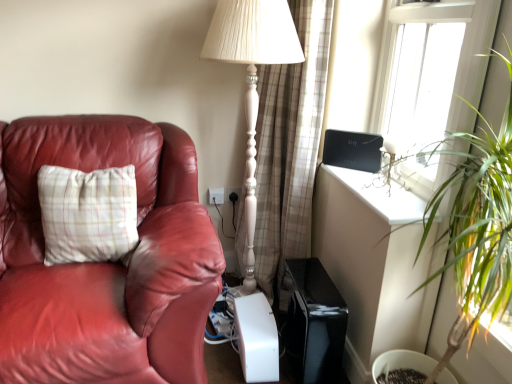
Image resolution: width=512 pixels, height=384 pixels. What are the coordinates of `white plastic electric outlet at lower center, arranged as the 2th electric outlet when viewed from the left` in the screenshot? It's located at (234, 194).

Image resolution: width=512 pixels, height=384 pixels. What do you see at coordinates (216, 196) in the screenshot?
I see `white plastic electric outlet at lower center, the first electric outlet in the left-to-right sequence` at bounding box center [216, 196].

Measure the distance between point (x=208, y=197) and camera.

They are 7.45 feet apart.

Where is `white plastic electric outlet at lower center, arranged as the 2th electric outlet when viewed from the left`? This screenshot has height=384, width=512. white plastic electric outlet at lower center, arranged as the 2th electric outlet when viewed from the left is located at coordinates (234, 194).

Is transparent glass window at upper right wider or thinner than white plastic electric outlet at lower center, which is counted as the first electric outlet, starting from the right?

In the image, transparent glass window at upper right appears to be wider than white plastic electric outlet at lower center, which is counted as the first electric outlet, starting from the right.

From the image's perspective, is transparent glass window at upper right below white plastic electric outlet at lower center, arranged as the 2th electric outlet when viewed from the left?

No, from the image's perspective, transparent glass window at upper right is not beneath white plastic electric outlet at lower center, arranged as the 2th electric outlet when viewed from the left.

Considering the relative sizes of transparent glass window at upper right and white plastic electric outlet at lower center, which is counted as the first electric outlet, starting from the right, in the image provided, is transparent glass window at upper right shorter than white plastic electric outlet at lower center, which is counted as the first electric outlet, starting from the right,?

In fact, transparent glass window at upper right may be taller than white plastic electric outlet at lower center, which is counted as the first electric outlet, starting from the right.

Could you tell me if transparent glass window at upper right is facing white plastic electric outlet at lower center, which is counted as the first electric outlet, starting from the right?

No, transparent glass window at upper right is not facing towards white plastic electric outlet at lower center, which is counted as the first electric outlet, starting from the right.

Is white plastic electric outlet at lower center, the 2th electric outlet viewed from the right, bigger than plaid fabric pillow at left?

No, white plastic electric outlet at lower center, the 2th electric outlet viewed from the right, is not bigger than plaid fabric pillow at left.

Looking at their sizes, would you say white plastic electric outlet at lower center, the 2th electric outlet viewed from the right, is wider or thinner than plaid fabric pillow at left?

Considering their sizes, white plastic electric outlet at lower center, the 2th electric outlet viewed from the right, looks slimmer than plaid fabric pillow at left.

From a real-world perspective, is white plastic electric outlet at lower center, the first electric outlet in the left-to-right sequence, over plaid fabric pillow at left?

No, from a real-world perspective, white plastic electric outlet at lower center, the first electric outlet in the left-to-right sequence, is not above plaid fabric pillow at left.

Can you tell me how much white plastic electric outlet at lower center, the 2th electric outlet viewed from the right, and plaid fabric pillow at left differ in facing direction?

14.5 degrees.

Is point (446, 1) farther from viewer compared to point (209, 191)?

No.

Is transparent glass window at upper right taller or shorter than white plastic electric outlet at lower center, the first electric outlet in the left-to-right sequence?

Clearly, transparent glass window at upper right is taller compared to white plastic electric outlet at lower center, the first electric outlet in the left-to-right sequence.

From a real-world perspective, is transparent glass window at upper right located higher than white plastic electric outlet at lower center, the 2th electric outlet viewed from the right?

Yes, from a real-world perspective, transparent glass window at upper right is over white plastic electric outlet at lower center, the 2th electric outlet viewed from the right

Considering the relative sizes of transparent glass window at upper right and white plastic electric outlet at lower center, the 2th electric outlet viewed from the right, in the image provided, is transparent glass window at upper right wider than white plastic electric outlet at lower center, the 2th electric outlet viewed from the right,?

Yes, transparent glass window at upper right is wider than white plastic electric outlet at lower center, the 2th electric outlet viewed from the right.

Where is `window above the green leafy plant at right (from the image's perspective)`? The width and height of the screenshot is (512, 384). window above the green leafy plant at right (from the image's perspective) is located at coordinates (432, 69).

In the scene shown: Which object is positioned more to the left, transparent glass window at upper right or green leafy plant at right?

Positioned to the left is transparent glass window at upper right.

From the image's perspective, between transparent glass window at upper right and green leafy plant at right, which one is located above?

transparent glass window at upper right.

Is plaid fabric curtain at center taller or shorter than transparent glass window at upper right?

Clearly, plaid fabric curtain at center is taller compared to transparent glass window at upper right.

Does plaid fabric curtain at center turn towards transparent glass window at upper right?

No.

Are plaid fabric curtain at center and transparent glass window at upper right making contact?

They are not placed beside each other.

You are a GUI agent. You are given a task and a screenshot of the screen. Output one action in this format:
    pyautogui.click(x=<x>, y=<y>)
    Task: Click on the houseplant below the white plastic electric outlet at lower center, the 2th electric outlet viewed from the right (from the image's perspective)
    The image size is (512, 384).
    Given the screenshot: What is the action you would take?
    pyautogui.click(x=476, y=226)

Is green leafy plant at right completely or partially outside of white plastic electric outlet at lower center, the first electric outlet in the left-to-right sequence?

green leafy plant at right is positioned outside white plastic electric outlet at lower center, the first electric outlet in the left-to-right sequence.

Is green leafy plant at right oriented away from white plastic electric outlet at lower center, the first electric outlet in the left-to-right sequence?

No, green leafy plant at right is not facing away from white plastic electric outlet at lower center, the first electric outlet in the left-to-right sequence.

Looking at this image, is green leafy plant at right positioned in front of white plastic electric outlet at lower center, the 2th electric outlet viewed from the right?

Yes, green leafy plant at right is closer to the viewer.

Considering the relative positions of white plastic electric outlet at lower center, which is counted as the first electric outlet, starting from the right, and transparent glass window at upper right in the image provided, is white plastic electric outlet at lower center, which is counted as the first electric outlet, starting from the right, behind transparent glass window at upper right?

Yes, the depth of white plastic electric outlet at lower center, which is counted as the first electric outlet, starting from the right, is greater than that of transparent glass window at upper right.

Is white plastic electric outlet at lower center, which is counted as the first electric outlet, starting from the right, not near transparent glass window at upper right?

Absolutely, white plastic electric outlet at lower center, which is counted as the first electric outlet, starting from the right, is distant from transparent glass window at upper right.

Is white plastic electric outlet at lower center, which is counted as the first electric outlet, starting from the right, turned away from transparent glass window at upper right?

white plastic electric outlet at lower center, which is counted as the first electric outlet, starting from the right, does not have its back to transparent glass window at upper right.

Can you confirm if white plastic electric outlet at lower center, which is counted as the first electric outlet, starting from the right, is positioned to the right of transparent glass window at upper right?

No, white plastic electric outlet at lower center, which is counted as the first electric outlet, starting from the right, is not to the right of transparent glass window at upper right.

From the transparent glass window at upper right, count the 1st electric outlet to the left and point to it. Please provide its 2D coordinates.

[(234, 194)]

Where is `the 1st electric outlet counting from the right side of the plaid fabric pillow at left`? Image resolution: width=512 pixels, height=384 pixels. the 1st electric outlet counting from the right side of the plaid fabric pillow at left is located at coordinates (216, 196).

Looking at the image, which one is located further to transparent glass window at upper right, green leafy plant at right or white plastic electric outlet at lower center, the first electric outlet in the left-to-right sequence?

Among the two, white plastic electric outlet at lower center, the first electric outlet in the left-to-right sequence, is located further to transparent glass window at upper right.

When comparing their distances from transparent glass window at upper right, does plaid fabric pillow at left or white plastic electric outlet at lower center, arranged as the 2th electric outlet when viewed from the left, seem closer?

white plastic electric outlet at lower center, arranged as the 2th electric outlet when viewed from the left, is closer to transparent glass window at upper right.

Considering their positions, is plaid fabric pillow at left positioned further to plaid fabric curtain at center than transparent glass window at upper right?

The object further to plaid fabric curtain at center is plaid fabric pillow at left.

Which object lies nearer to the anchor point plaid fabric pillow at left, plaid fabric curtain at center or white plastic electric outlet at lower center, the first electric outlet in the left-to-right sequence?

Based on the image, white plastic electric outlet at lower center, the first electric outlet in the left-to-right sequence, appears to be nearer to plaid fabric pillow at left.

In the scene shown: Looking at the image, which one is located closer to transparent glass window at upper right, plaid fabric curtain at center or white plastic electric outlet at lower center, the first electric outlet in the left-to-right sequence?

The object closer to transparent glass window at upper right is plaid fabric curtain at center.

From the image, which object appears to be farther from white plastic electric outlet at lower center, the 2th electric outlet viewed from the right, green leafy plant at right or plaid fabric pillow at left?

green leafy plant at right lies further to white plastic electric outlet at lower center, the 2th electric outlet viewed from the right, than the other object.

Looking at this image, looking at the image, which one is located further to green leafy plant at right, white plastic electric outlet at lower center, which is counted as the first electric outlet, starting from the right, or plaid fabric pillow at left?

Based on the image, white plastic electric outlet at lower center, which is counted as the first electric outlet, starting from the right, appears to be further to green leafy plant at right.

Based on the photo, when comparing their distances from green leafy plant at right, does transparent glass window at upper right or plaid fabric pillow at left seem closer?

The object closer to green leafy plant at right is transparent glass window at upper right.

At what (x,y) coordinates should I click in order to perform the action: click on curtain between plaid fabric pillow at left and white plastic electric outlet at lower center, the 2th electric outlet viewed from the right, along the z-axis. Please return your answer as a coordinate pair (x, y). The width and height of the screenshot is (512, 384). Looking at the image, I should click on (290, 145).

Locate an element on the screen. The image size is (512, 384). window between plaid fabric pillow at left and green leafy plant at right in the horizontal direction is located at coordinates (432, 69).

Where is `curtain between plaid fabric pillow at left and transparent glass window at upper right from left to right`? This screenshot has width=512, height=384. curtain between plaid fabric pillow at left and transparent glass window at upper right from left to right is located at coordinates (290, 145).

Where is `curtain between transparent glass window at upper right and white plastic electric outlet at lower center, the 2th electric outlet viewed from the right, along the z-axis`? The image size is (512, 384). curtain between transparent glass window at upper right and white plastic electric outlet at lower center, the 2th electric outlet viewed from the right, along the z-axis is located at coordinates (290, 145).